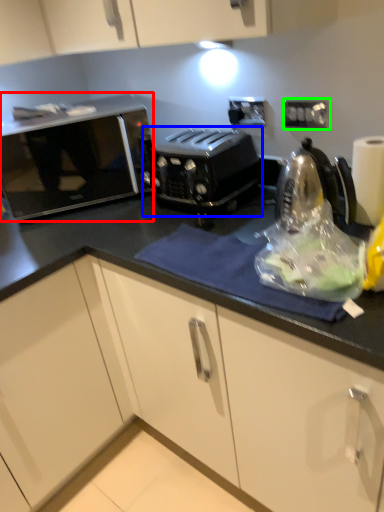
Question: Which is farther away from home appliance (highlighted by a red box)? toaster (highlighted by a blue box) or electric outlet (highlighted by a green box)?

Choices:
 (A) toaster
 (B) electric outlet

Answer: (B)